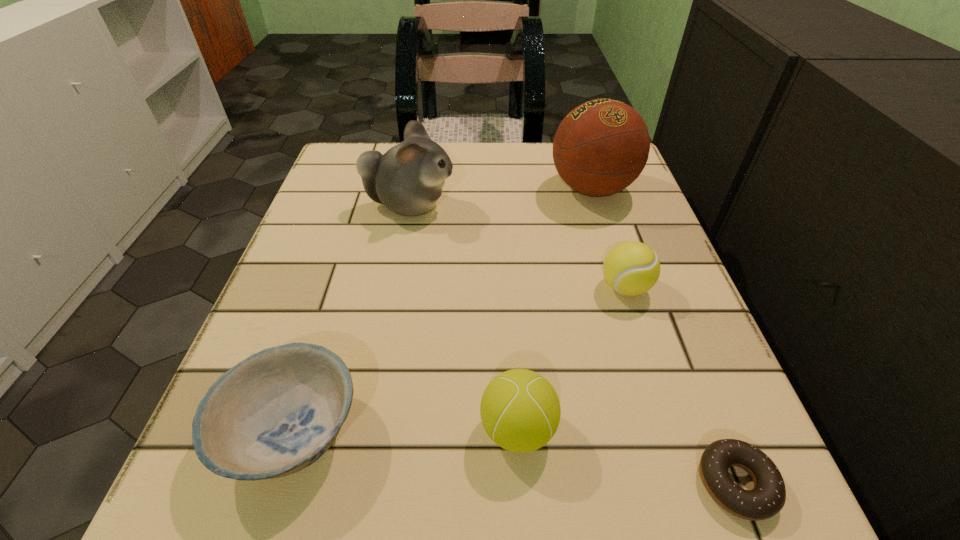
At what (x,y) coordinates should I click in order to perform the action: click on vacant space in between the fourth object from right to left and the fourth nearest object. Please return your answer as a coordinate pair (x, y). This screenshot has width=960, height=540. Looking at the image, I should click on (571, 358).

The width and height of the screenshot is (960, 540). I want to click on free space that is in between the hamster and the basketball, so click(501, 197).

This screenshot has height=540, width=960. What are the coordinates of `free spot between the bowl and the doughnut` in the screenshot? It's located at (515, 457).

This screenshot has height=540, width=960. Find the location of `free point between the basketball and the third farthest object`. free point between the basketball and the third farthest object is located at coordinates (609, 238).

Choose which object is the fourth nearest neighbor to the fourth object from right to left. Please provide its 2D coordinates. Your answer should be formatted as a tuple, i.e. [(x, y)], where the tuple contains the x and y coordinates of a point satisfying the conditions above.

[(408, 179)]

At what (x,y) coordinates should I click in order to perform the action: click on object identified as the second closest to the fourth object from right to left. Please return your answer as a coordinate pair (x, y). This screenshot has width=960, height=540. Looking at the image, I should click on (767, 498).

I want to click on free location that satisfies the following two spatial constraints: 1. on the face of the shortest object; 2. on the right side of the second tallest object, so click(357, 483).

This screenshot has height=540, width=960. Identify the location of vacant space that satisfies the following two spatial constraints: 1. on the face of the right tennis ball; 2. on the right side of the fifth shortest object. (394, 287).

Find the location of `free space that satisfies the following two spatial constraints: 1. on the back side of the fourth object from right to left; 2. on the face of the hamster`. free space that satisfies the following two spatial constraints: 1. on the back side of the fourth object from right to left; 2. on the face of the hamster is located at coordinates (504, 206).

The width and height of the screenshot is (960, 540). In order to click on free region that satisfies the following two spatial constraints: 1. on the face of the doughnut; 2. on the right side of the fifth shortest object in this screenshot , I will do `click(357, 483)`.